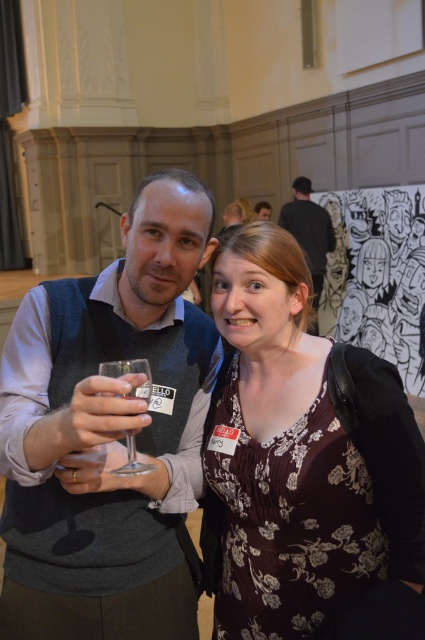
Question: Considering the relative positions of dark gray sweater vest at center and black fabric at upper center in the image provided, where is dark gray sweater vest at center located with respect to black fabric at upper center?

Choices:
 (A) left
 (B) right

Answer: (A)

Question: Does dark gray sweater vest at center appear on the right side of clear glass wine glass at center?

Choices:
 (A) no
 (B) yes

Answer: (A)

Question: Which object is farther from the camera taking this photo?

Choices:
 (A) matte floral dress at center
 (B) clear glass wine glass at center

Answer: (A)

Question: Is black fabric at upper center above clear glass wine glass at center?

Choices:
 (A) no
 (B) yes

Answer: (B)

Question: Which point appears closest to the camera in this image?

Choices:
 (A) coord(150,376)
 (B) coord(201,392)
 (C) coord(413,563)

Answer: (A)

Question: Which object appears closest to the camera in this image?

Choices:
 (A) matte floral dress at center
 (B) dark gray sweater vest at center
 (C) clear glass wine glass at center
 (D) black fabric at upper center

Answer: (B)